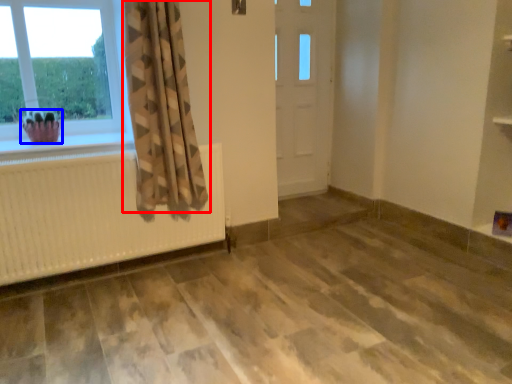
Question: Which object is closer to the camera taking this photo, curtain (highlighted by a red box) or plant (highlighted by a blue box)?

Choices:
 (A) curtain
 (B) plant

Answer: (A)